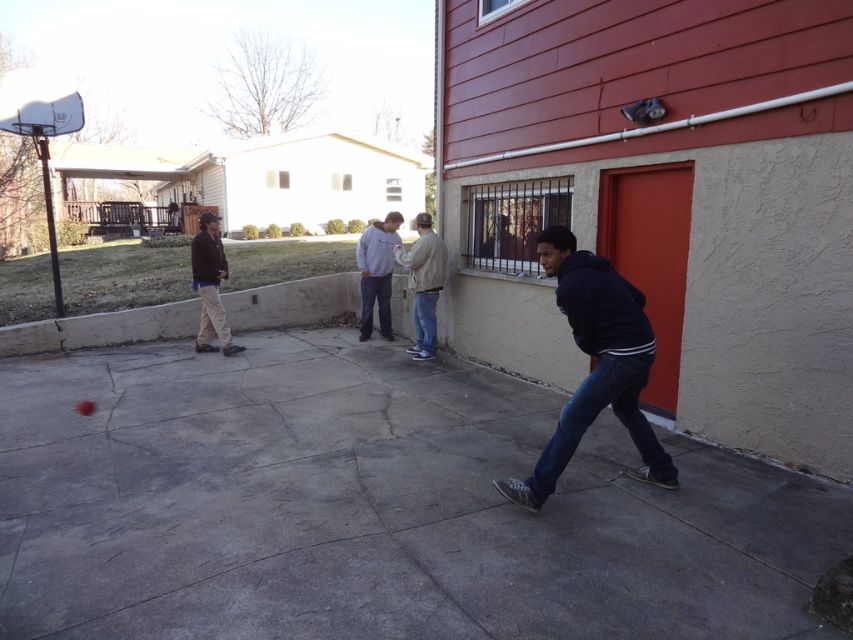
Does point (47, 216) lie behind point (207, 243)?

Yes, it is behind point (207, 243).

Can you confirm if white plastic basketball hoop at upper left is wider than khaki pants at left?

Correct, the width of white plastic basketball hoop at upper left exceeds that of khaki pants at left.

Which is behind, point (26, 109) or point (225, 326)?

The point (225, 326) is behind.

At what (x,y) coordinates should I click in order to perform the action: click on white plastic basketball hoop at upper left. Please return your answer as a coordinate pair (x, y). This screenshot has width=853, height=640. Looking at the image, I should click on (39, 132).

Between point (804, 568) and point (74, 118), which one is positioned behind?

Positioned behind is point (74, 118).

The height and width of the screenshot is (640, 853). In order to click on gray concrete pavement at center in this screenshot , I will do `click(373, 508)`.

The image size is (853, 640). I want to click on gray concrete pavement at center, so click(373, 508).

Between dark blue hoodie at center and khaki pants at left, which one appears on the right side from the viewer's perspective?

From the viewer's perspective, dark blue hoodie at center appears more on the right side.

Does dark blue hoodie at center come in front of khaki pants at left?

Yes, it is in front of khaki pants at left.

Does point (589, 262) come closer to viewer compared to point (215, 266)?

Yes.

The height and width of the screenshot is (640, 853). Find the location of `dark blue hoodie at center`. dark blue hoodie at center is located at coordinates (595, 365).